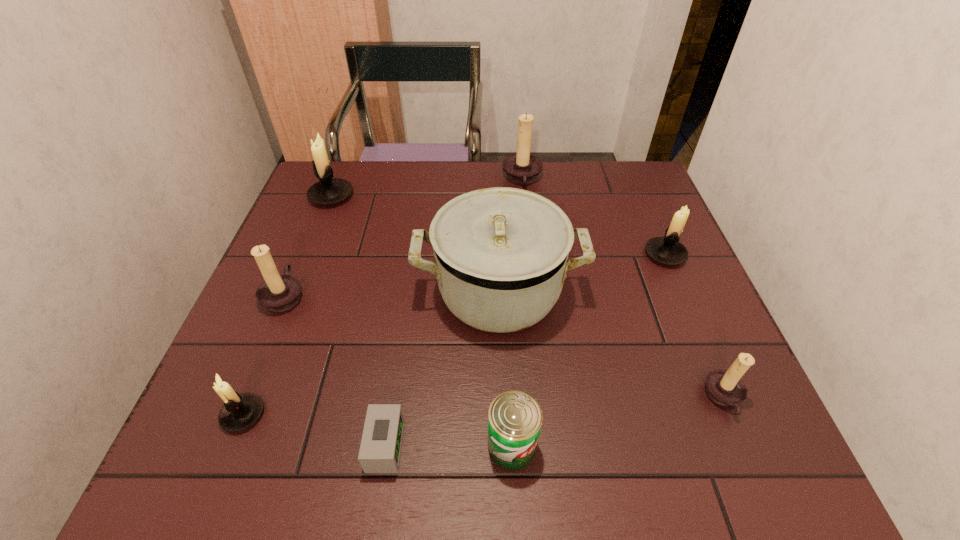
At what (x,y) coordinates should I click in order to perform the action: click on free space that satisfies the following two spatial constraints: 1. on the front side of the rightmost white candle holder; 2. on the wick of the second nearest brown candle holder. Please return your answer as a coordinate pair (x, y). The image size is (960, 540). Looking at the image, I should click on (683, 295).

Find the location of a particular element. The image size is (960, 540). vacant region that satisfies the following two spatial constraints: 1. on the wick of the third nearest candle holder; 2. on the back side of the nearest white candle holder is located at coordinates (236, 414).

Locate an element on the screen. The image size is (960, 540). vacant region that satisfies the following two spatial constraints: 1. on the wick of the farthest brown candle holder; 2. on the right side of the rightmost white candle holder is located at coordinates [x=531, y=255].

I want to click on vacant space that satisfies the following two spatial constraints: 1. on the front side of the saucepan; 2. on the wick of the second nearest brown candle holder, so click(499, 295).

Where is `free space in the image that satisfies the following two spatial constraints: 1. on the wick of the farthest brown candle holder; 2. on the back side of the second biggest white candle holder`? The width and height of the screenshot is (960, 540). free space in the image that satisfies the following two spatial constraints: 1. on the wick of the farthest brown candle holder; 2. on the back side of the second biggest white candle holder is located at coordinates (531, 255).